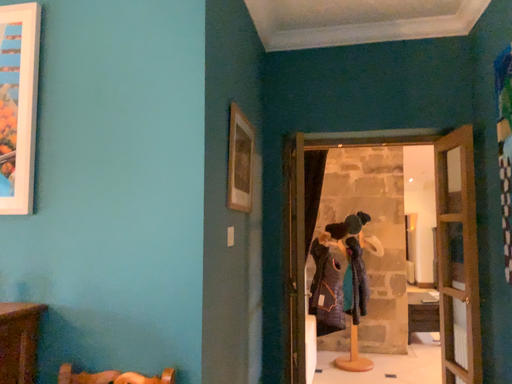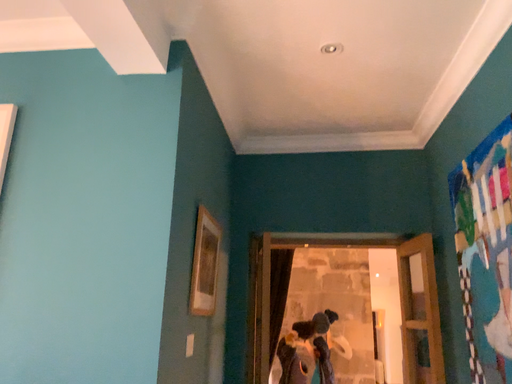
Question: How did the camera likely rotate when shooting the video?

Choices:
 (A) rotated upward
 (B) rotated downward

Answer: (A)